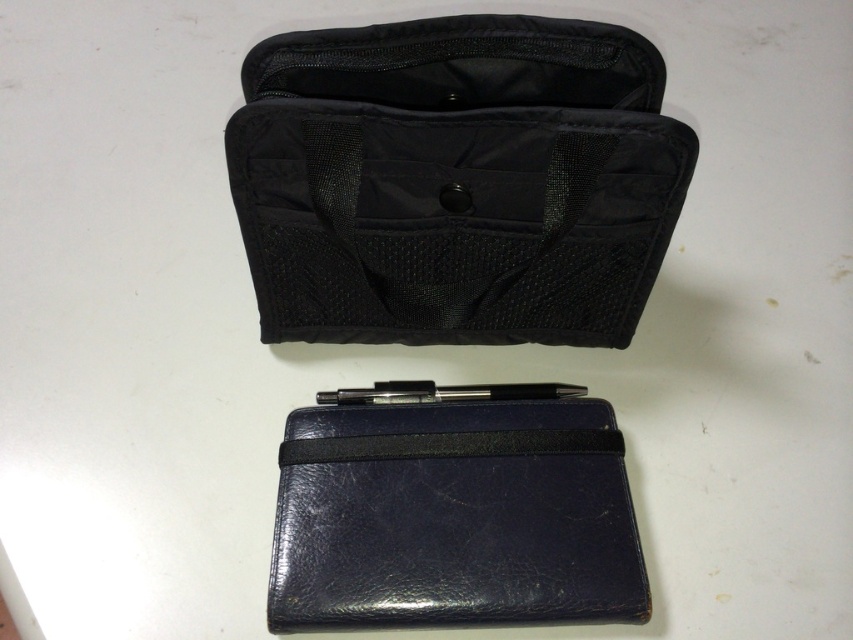
You are organizing items on a desk and see the black fabric pouch at center and the navy leather pouch at center. Which one is positioned more to the left?

The black fabric pouch at center is positioned more to the left than the navy leather pouch at center.

You are standing 5 feet away from the camera. Can you reach the point at coordinates (x=572, y=24) with your hand?

The point at coordinates (x=572, y=24) is 3.91 feet from the camera. Since you are standing 5 feet away from the camera, the distance between you and the point is 1.09 feet. Therefore, you can reach the point with your hand.

You are organizing items on a desk and see the black fabric pouch at center and the navy leather pouch at center. Which one is positioned higher up?

The black fabric pouch at center is located above the navy leather pouch at center, so it is positioned higher up.